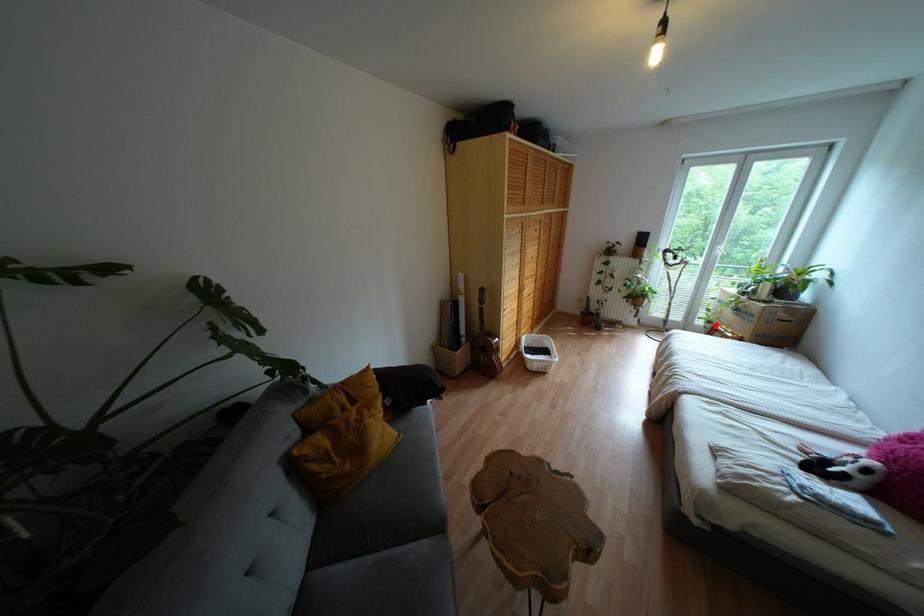
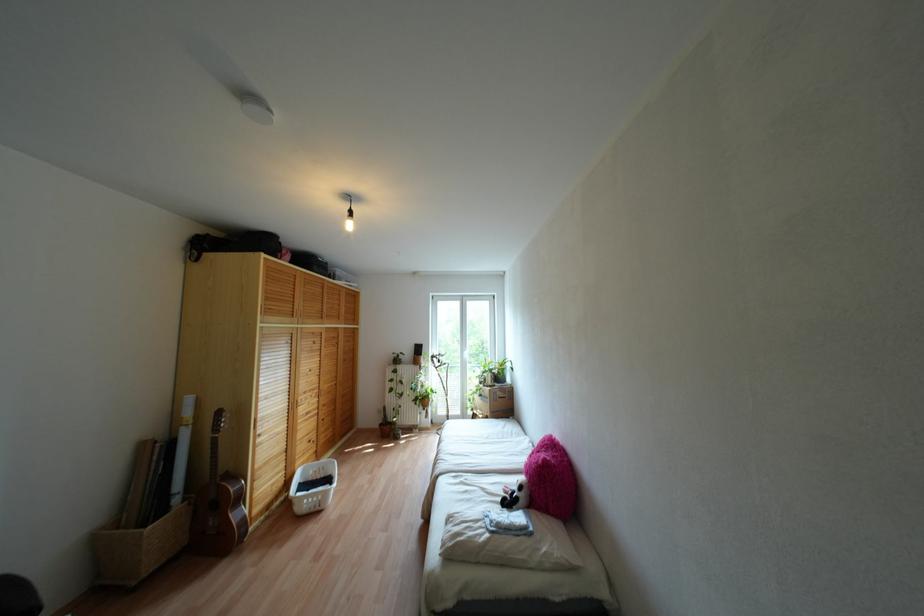
Question: I am providing you with two images of the same scene from different viewpoints. Image1 has a red point marked. In image2, the corresponding 3D location appears at what relative position? Reply with the corresponding letter.

Choices:
 (A) Closer
 (B) Farther

Answer: (B)